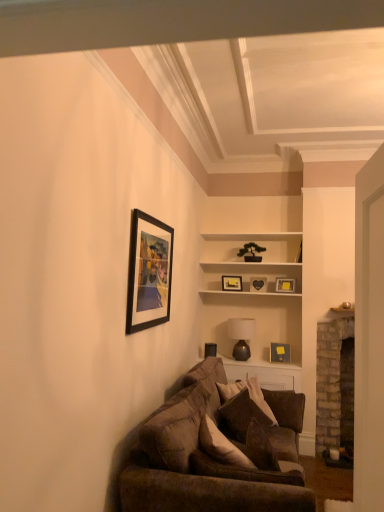
Question: From a real-world perspective, is black matte picture frame at upper left, marked as the sixth picture frame in a right-to-left arrangement, physically below brick fireplace at right?

Choices:
 (A) no
 (B) yes

Answer: (A)

Question: Is black matte picture frame at upper left, the sixth picture frame positioned from the bottom, positioned with its back to brick fireplace at right?

Choices:
 (A) no
 (B) yes

Answer: (A)

Question: Is black matte picture frame at upper left, marked as the sixth picture frame in a right-to-left arrangement, shorter than brick fireplace at right?

Choices:
 (A) no
 (B) yes

Answer: (B)

Question: Does black matte picture frame at upper left, the sixth picture frame positioned from the bottom, turn towards brick fireplace at right?

Choices:
 (A) yes
 (B) no

Answer: (B)

Question: From the image's perspective, would you say black matte picture frame at upper left, the 1th picture frame from the left, is positioned over brick fireplace at right?

Choices:
 (A) yes
 (B) no

Answer: (A)

Question: Is black matte picture frame at upper left, placed as the 6th picture frame when sorted from back to front, to the left of brick fireplace at right from the viewer's perspective?

Choices:
 (A) no
 (B) yes

Answer: (B)

Question: From the image's perspective, is velvet brown couch at lower center beneath black matte picture frame at upper left, the sixth picture frame positioned from the bottom?

Choices:
 (A) no
 (B) yes

Answer: (B)

Question: Is velvet brown couch at lower center facing towards black matte picture frame at upper left, arranged as the first picture frame when viewed from the front?

Choices:
 (A) yes
 (B) no

Answer: (B)

Question: Is velvet brown couch at lower center turned away from black matte picture frame at upper left, the sixth picture frame positioned from the bottom?

Choices:
 (A) no
 (B) yes

Answer: (A)

Question: Considering the relative sizes of velvet brown couch at lower center and black matte picture frame at upper left, marked as the sixth picture frame in a right-to-left arrangement, in the image provided, is velvet brown couch at lower center wider than black matte picture frame at upper left, marked as the sixth picture frame in a right-to-left arrangement,?

Choices:
 (A) no
 (B) yes

Answer: (B)

Question: Is velvet brown couch at lower center taller than black matte picture frame at upper left, the 1th picture frame from the left?

Choices:
 (A) yes
 (B) no

Answer: (A)

Question: Is velvet brown couch at lower center thinner than black matte picture frame at upper left, marked as the sixth picture frame in a right-to-left arrangement?

Choices:
 (A) yes
 (B) no

Answer: (B)

Question: Is matte black picture frame at upper center, the second picture frame from the bottom, at the left side of black matte picture frame at upper left, the 1th picture frame from the left?

Choices:
 (A) yes
 (B) no

Answer: (B)